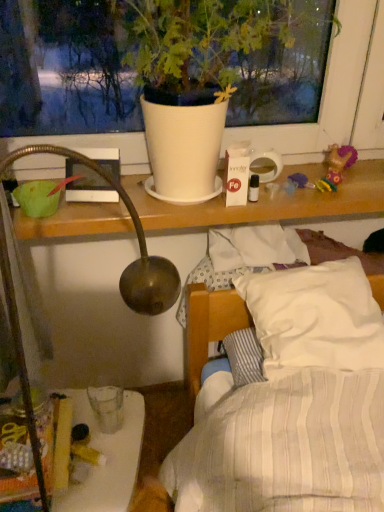
Question: Considering the positions of point (117, 465) and point (342, 165), is point (117, 465) closer or farther from the camera than point (342, 165)?

Choices:
 (A) farther
 (B) closer

Answer: (B)

Question: From a real-world perspective, relative to plush purple doll at upper right, is translucent plastic glass at lower left vertically above or below?

Choices:
 (A) below
 (B) above

Answer: (A)

Question: Considering the real-world distances, which object is closest to the plush purple doll at upper right?

Choices:
 (A) translucent plastic glass at lower left
 (B) white matte pot at upper center

Answer: (B)

Question: Which object is the closest to the translucent plastic glass at lower left?

Choices:
 (A) white matte pot at upper center
 (B) plush purple doll at upper right

Answer: (A)